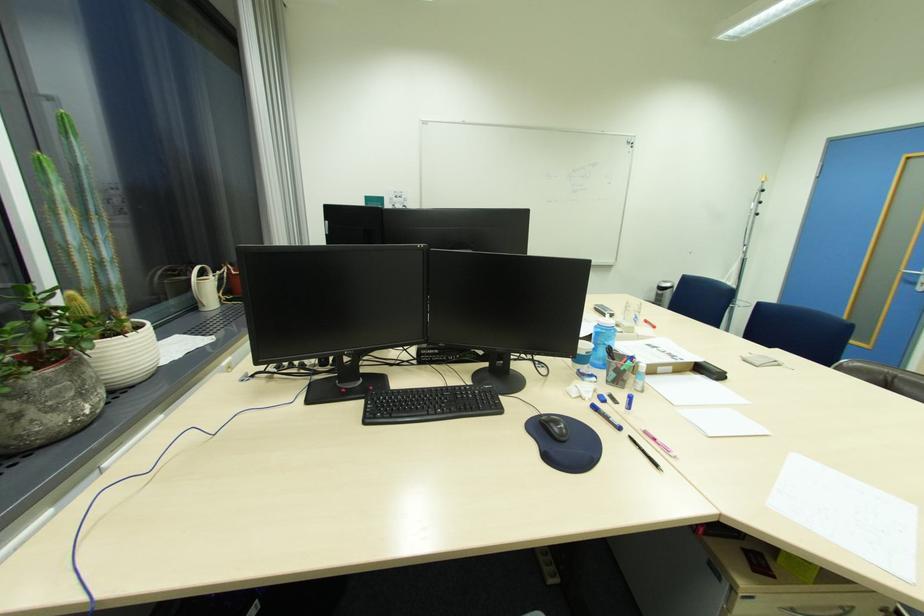
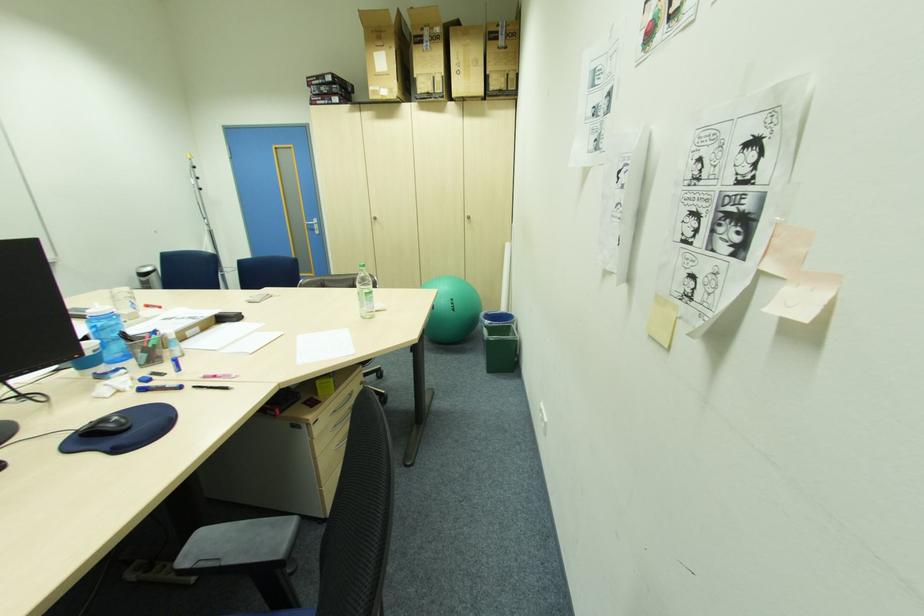
Based on the continuous images, in which direction is the camera rotating?

The rotation direction of the camera is right-down.